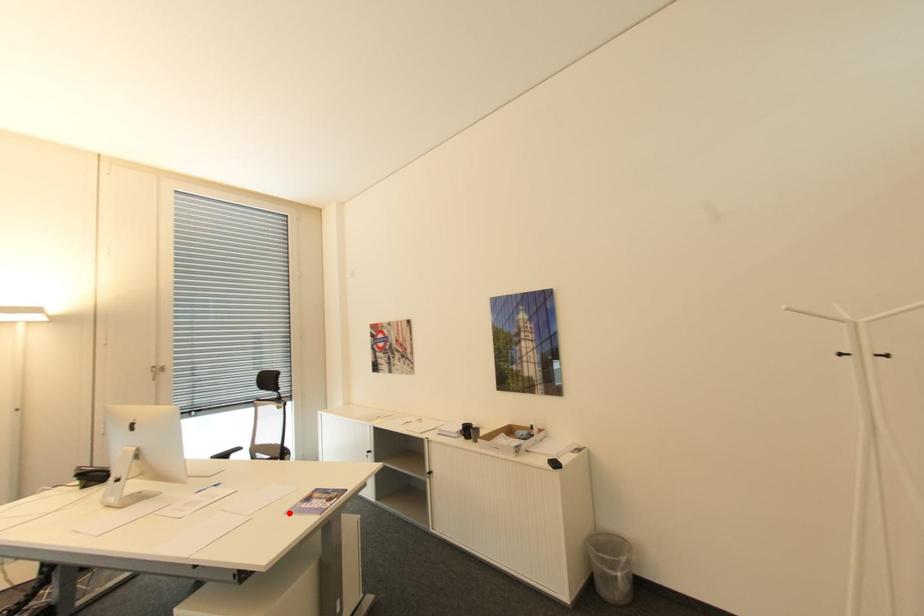
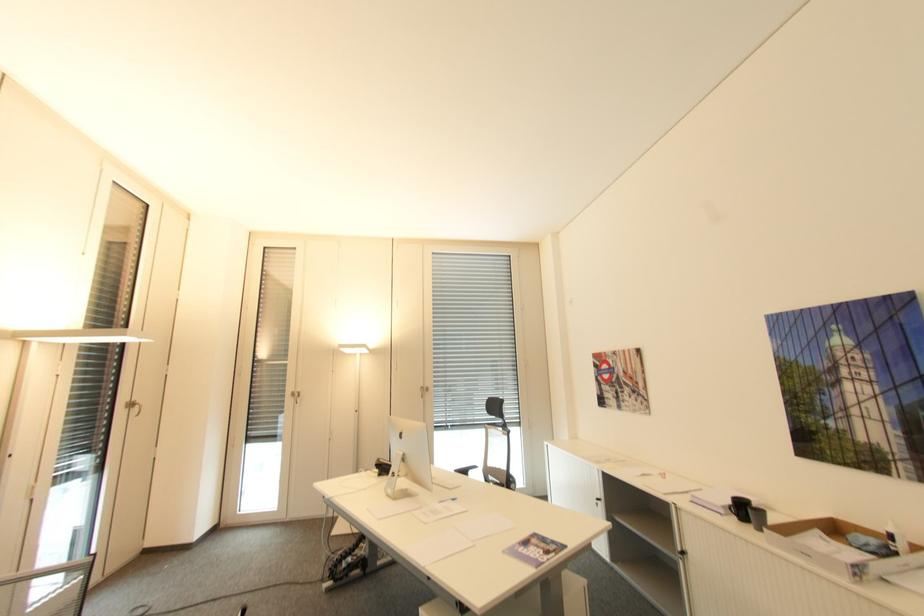
Find the pixel in the second image that matches the highlighted location in the first image.

(507, 553)